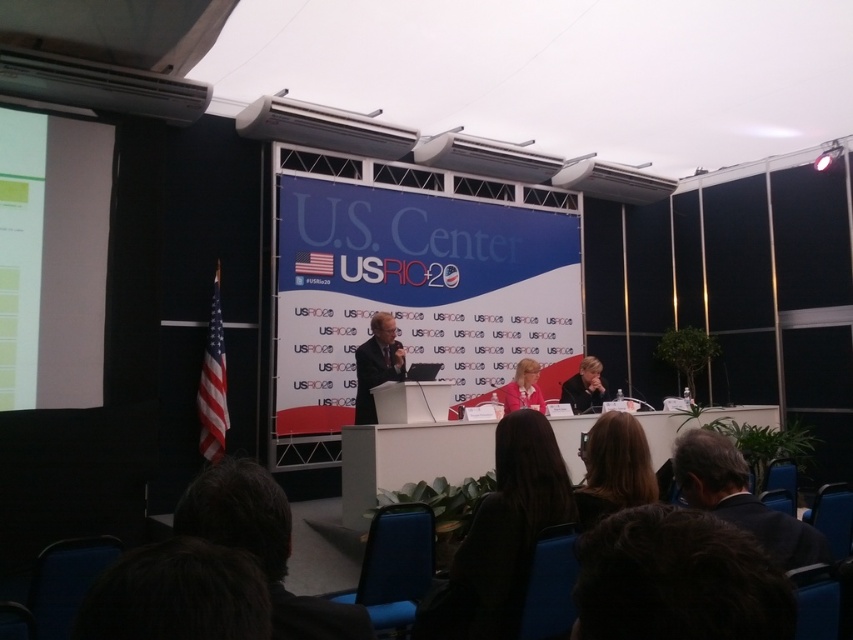
Question: Which point appears farthest from the camera in this image?

Choices:
 (A) (108, 140)
 (B) (346, 364)
 (C) (270, 547)

Answer: (B)

Question: Which object appears farthest from the camera in this image?

Choices:
 (A) smooth black hair at center
 (B) dark brown hair at lower center
 (C) dark suit at center
 (D) dark blue suit at lower right

Answer: (A)

Question: Is dark brown hair at lower center above dark suit at center?

Choices:
 (A) yes
 (B) no

Answer: (B)

Question: Is black fabric hair at lower center bigger than dark blue suit at lower right?

Choices:
 (A) yes
 (B) no

Answer: (A)

Question: Is white matte projection screen at left smaller than dark brown hair at lower center?

Choices:
 (A) yes
 (B) no

Answer: (B)

Question: Which of these objects is positioned farthest from the black fabric hair at lower center?

Choices:
 (A) dark brown hair at lower left
 (B) dark brown hair at lower center

Answer: (A)